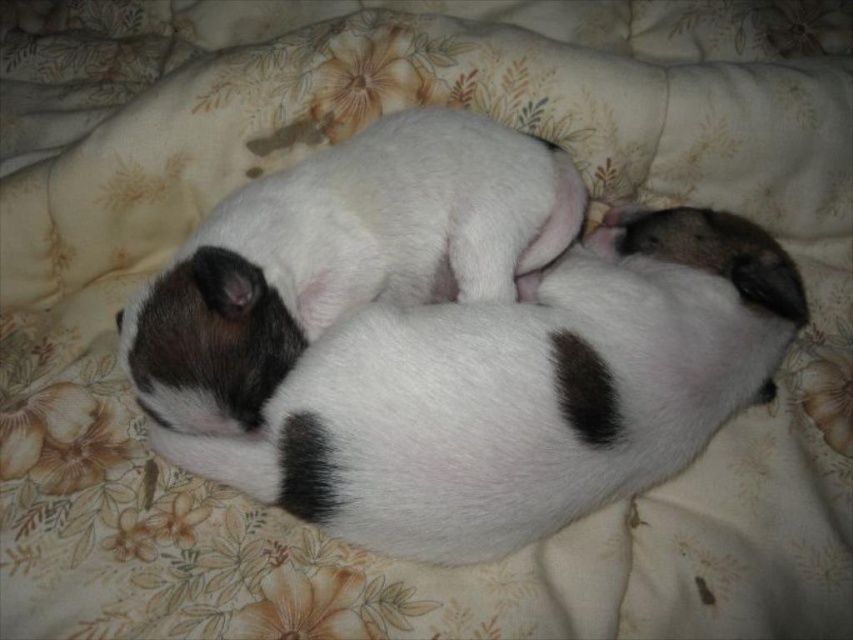
Consider the image. You are a photographer trying to capture the two white fur dogs at center. Since the white soft fur dog at center is below the white fur dog at center, which one should you focus on to ensure the top dog remains in frame?

The white soft fur dog at center is below the white fur dog at center, so you should focus on the white fur dog at center to keep it in the frame as the top dog.

You are a photographer trying to capture a closeup of the white soft fur dog at center and the white fur dog at center. Since they are very close, you need to adjust your camera focus. Which dog should you focus on first if you want to ensure the one on the left is in focus?

The white soft fur dog at center is positioned on the right side of white fur dog at center. Therefore, to focus on the one on the left first, you should adjust the camera to focus on the white fur dog at center first since it is on the left side.

You are a photographer trying to capture a closeup of the smaller dog in the scene. Given that both white soft fur dog at center and white fur dog at center are resting closely together, which one should you focus on to ensure you capture the smaller one?

The white soft fur dog at center that is curled up partially underneath the other is the smaller one, so you should focus on that one to capture the smaller dog.